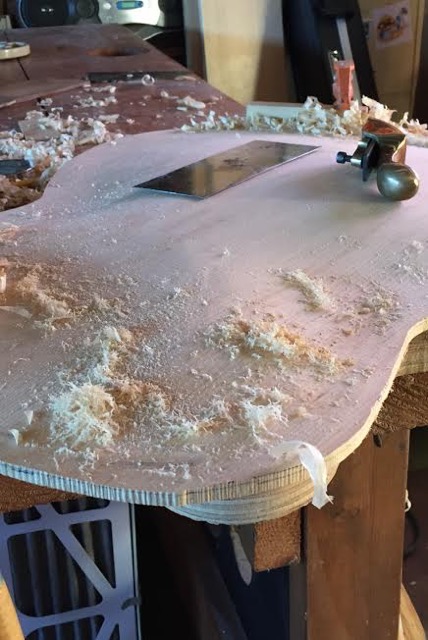
Find the location of a particular element. This screenshot has width=428, height=640. edge of table top is located at coordinates (412, 372).